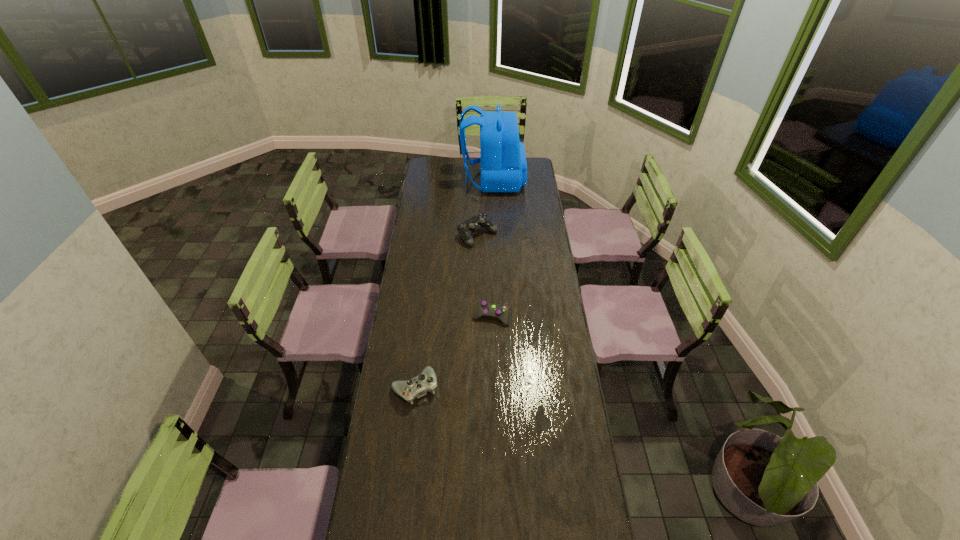
The image size is (960, 540). I want to click on free region at the far left corner, so click(x=427, y=158).

Where is `vacant space at the far right corner of the desktop`? The width and height of the screenshot is (960, 540). vacant space at the far right corner of the desktop is located at coordinates (529, 157).

Find the location of a particular element. empty space that is in between the leftmost object and the farthest object is located at coordinates (454, 284).

Where is `free space that is in between the tallest control and the farthest object`? free space that is in between the tallest control and the farthest object is located at coordinates 485,208.

Locate an element on the screen. empty space that is in between the farthest control and the leftmost control is located at coordinates (446, 312).

You are a GUI agent. You are given a task and a screenshot of the screen. Output one action in this format:
    pyautogui.click(x=<x>, y=<y>)
    Task: Click on the blank region between the farthest control and the nearest object
    The width and height of the screenshot is (960, 540).
    Given the screenshot: What is the action you would take?
    pyautogui.click(x=446, y=312)

In order to click on free space between the shortest object and the leftmost object in this screenshot , I will do `click(453, 352)`.

At what (x,y) coordinates should I click in order to perform the action: click on empty location between the backpack and the second shortest object. Please return your answer as a coordinate pair (x, y). This screenshot has height=540, width=960. Looking at the image, I should click on (454, 284).

At what (x,y) coordinates should I click in order to perform the action: click on empty space between the backpack and the nearest control. Please return your answer as a coordinate pair (x, y). The height and width of the screenshot is (540, 960). Looking at the image, I should click on (454, 284).

What are the coordinates of `free space between the second nearest control and the nearest object` in the screenshot? It's located at (453, 352).